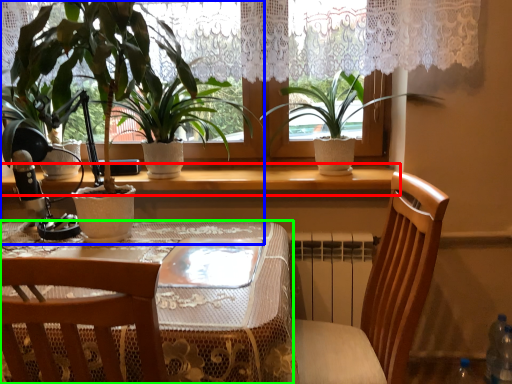
Question: Which object is the farthest from window sill (highlighted by a red box)? Choose among these: houseplant (highlighted by a blue box) or table (highlighted by a green box).

Choices:
 (A) houseplant
 (B) table

Answer: (B)